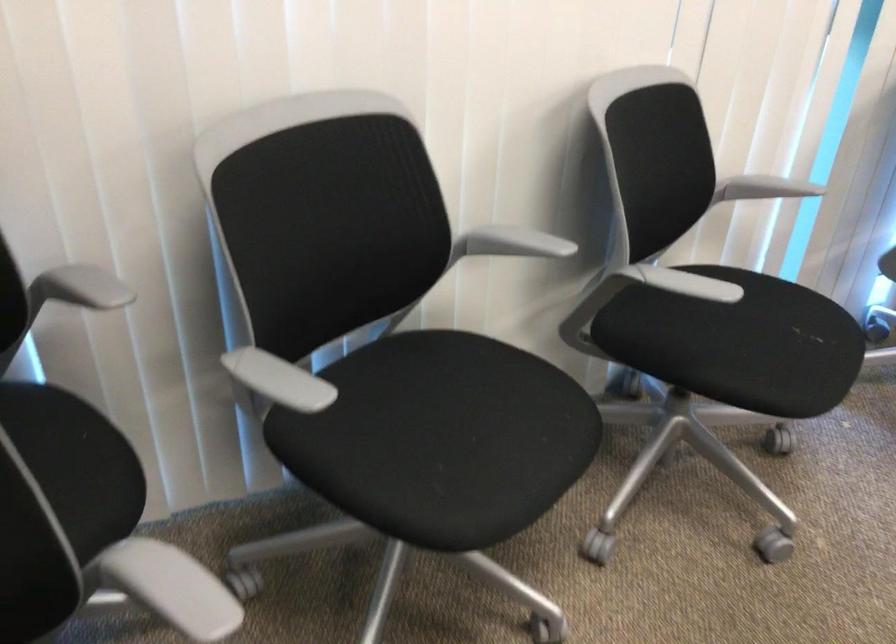
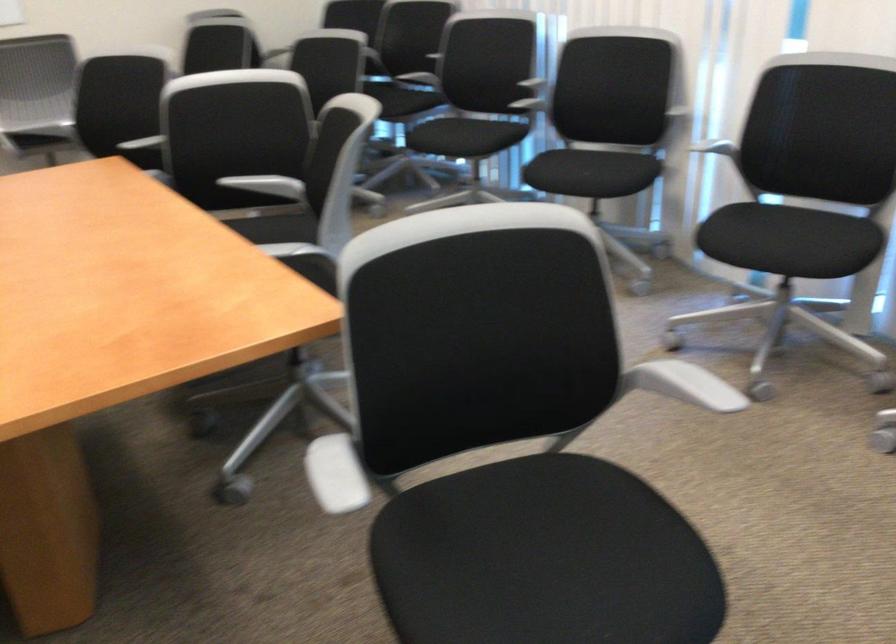
In the second image, find the point that corresponds to point (805, 328) in the first image.

(587, 174)